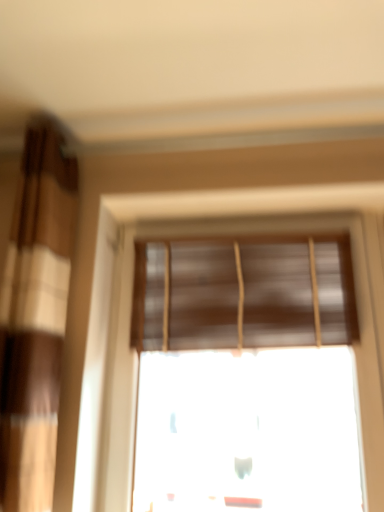
Question: Is brown textured curtain at left situated inside brown matte blinds at center or outside?

Choices:
 (A) outside
 (B) inside

Answer: (A)

Question: Based on their positions, is brown textured curtain at left located to the left or right of brown matte blinds at center?

Choices:
 (A) right
 (B) left

Answer: (B)

Question: Estimate the real-world distances between objects in this image. Which object is closer to the brown matte window blind at upper center?

Choices:
 (A) brown matte blinds at center
 (B) brown textured curtain at left

Answer: (A)

Question: Which is farther from the brown matte window blind at upper center?

Choices:
 (A) brown matte blinds at center
 (B) brown textured curtain at left

Answer: (B)